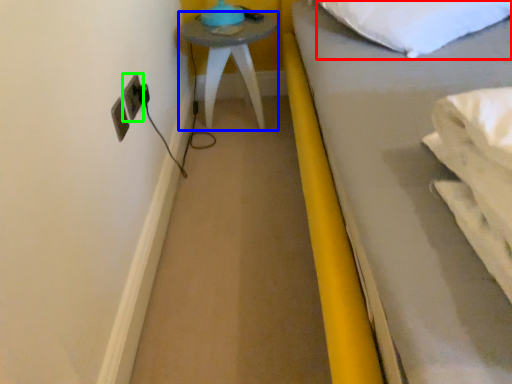
Question: Considering the real-world distances, which object is farthest from pillow (highlighted by a red box)? furniture (highlighted by a blue box) or electric outlet (highlighted by a green box)?

Choices:
 (A) furniture
 (B) electric outlet

Answer: (B)